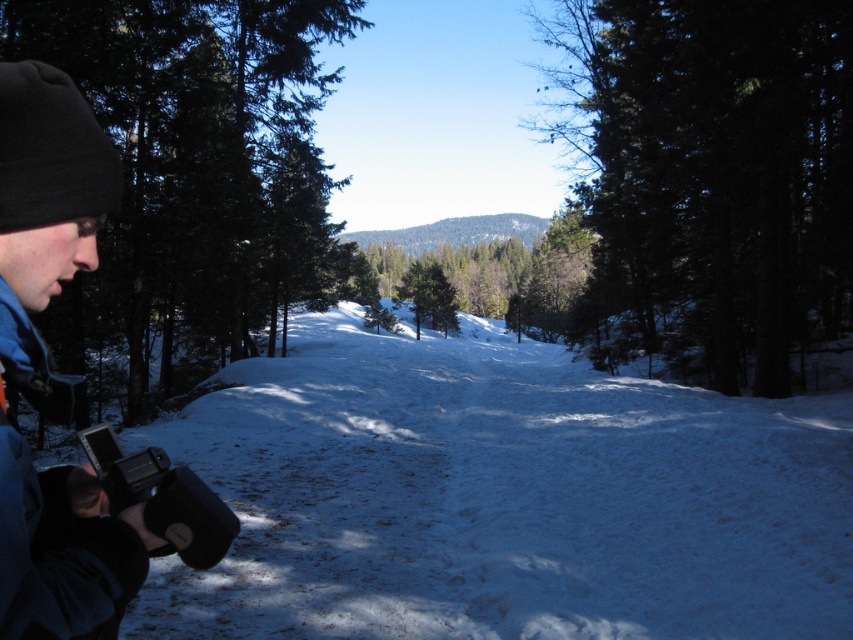
Is white powdery snow at center wider than blue fleece jacket at lower left?

Indeed, white powdery snow at center has a greater width compared to blue fleece jacket at lower left.

Who is higher up, white powdery snow at center or blue fleece jacket at lower left?

Positioned higher is blue fleece jacket at lower left.

The height and width of the screenshot is (640, 853). I want to click on white powdery snow at center, so click(x=502, y=497).

Can you confirm if white powdery snow at center is wider than green matte tree at left?

No, white powdery snow at center is not wider than green matte tree at left.

Where is `white powdery snow at center`? white powdery snow at center is located at coordinates (502, 497).

Does point (691, 582) come in front of point (229, 104)?

Yes, point (691, 582) is closer to viewer.

Identify the location of white powdery snow at center. pyautogui.click(x=502, y=497).

Is white powdery snow at center in front of green matte tree at center?

Yes, white powdery snow at center is in front of green matte tree at center.

Does white powdery snow at center have a greater width compared to green matte tree at center?

No.

Who is more distant from viewer, (560, 428) or (718, 81)?

Point (718, 81)

Where is `white powdery snow at center`? The height and width of the screenshot is (640, 853). white powdery snow at center is located at coordinates (502, 497).